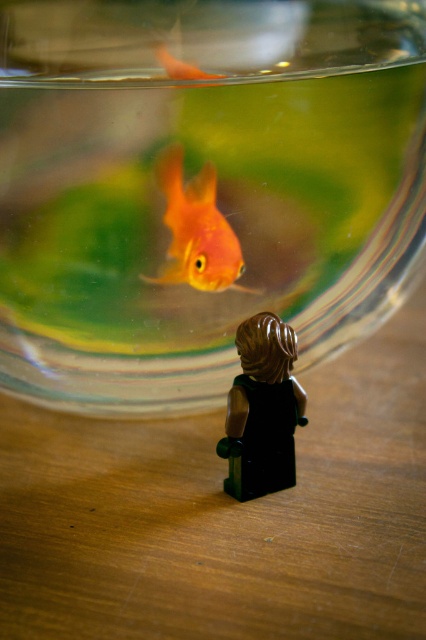
You are standing in front of the fishbowl and want to feed the shiny orange fish at center. If your hand is 4 inches away from the fish, can you reach it without moving your hand?

The shiny orange fish at center is 4.05 inches away from the viewer. Since your hand is only 4 inches away, you can reach the shiny orange fish at center because it is slightly closer than the required distance.